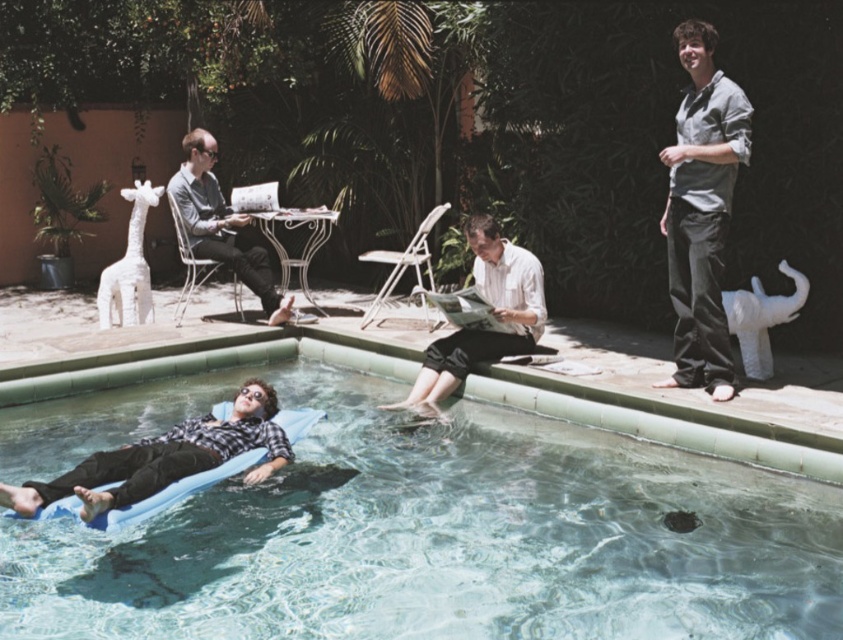
You are planning to place a 6 feet long wooden bench in the backyard. The blue foam mattress at lower left and white paper at center are two objects you want to avoid blocking. Can you fit the bench between them without overlapping?

The blue foam mattress at lower left and white paper at center are 5.97 feet apart. Since the bench is 6 feet long, placing it between them would require at least 6 feet of space, which is slightly more than the available 5.97 feet. Therefore, the bench cannot be placed between them without overlapping.